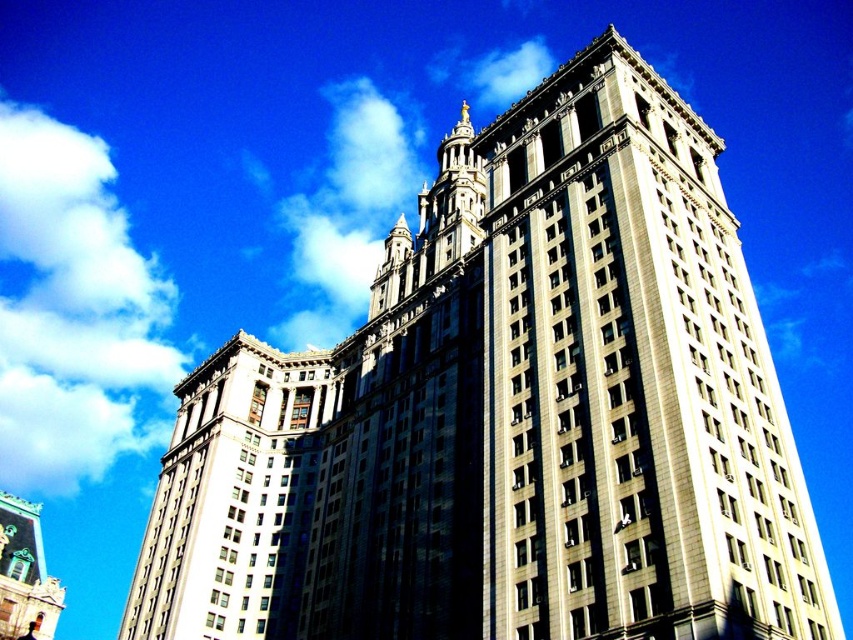
You are a tourist standing in front of the grand building. You notice the white marble tower at center and the green copper dome at lower left. Which object is located higher up in the image?

The white marble tower at center is positioned over the green copper dome at lower left, so it is higher up in the image.

You are an architect designing a new building and are inspired by the classical style of the white marble tower at center. You want to ensure that the shadow cast by the tower does not block the view of the white fluffy cloud at upper left from the main entrance. Based on the scene, can you determine if the tower is wide enough to block the cloud?

The white fluffy cloud at upper left might be wider than the white marble tower at center, so there is a possibility that the tower could block the view of the cloud if its width is comparable or greater. However, since the cloud is wider, it might still be partially visible depending on their exact positions and the angle of the sun.

You are standing in front of the grand building and want to take a photo that includes both the white marble tower at center and the green copper dome at lower left. Based on their positions, which object should you position on the right side of your camera frame?

You should position the white marble tower at center on the right side of your camera frame since it is already to the right of the green copper dome at lower left.